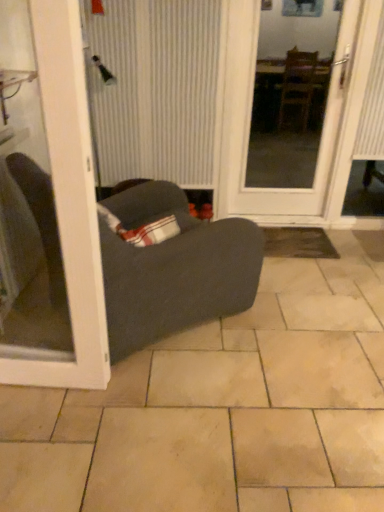
Question: Does beige ceramic tile at center have a greater height compared to white glossy door at left, arranged as the 1th door when viewed from the left?

Choices:
 (A) yes
 (B) no

Answer: (B)

Question: Does beige ceramic tile at center come behind white glossy door at left, acting as the 1th door starting from the front?

Choices:
 (A) yes
 (B) no

Answer: (A)

Question: Could you tell me if beige ceramic tile at center is facing white glossy door at left, acting as the 1th door starting from the front?

Choices:
 (A) no
 (B) yes

Answer: (A)

Question: From the image's perspective, is beige ceramic tile at center located above white glossy door at left, arranged as the 1th door when viewed from the left?

Choices:
 (A) yes
 (B) no

Answer: (B)

Question: Is beige ceramic tile at center thinner than white glossy door at left, placed as the second door when sorted from right to left?

Choices:
 (A) no
 (B) yes

Answer: (A)

Question: From the image's perspective, is white striped curtain at center located above or below beige ceramic tile at center?

Choices:
 (A) below
 (B) above

Answer: (B)

Question: In the image, is white striped curtain at center on the left side or the right side of beige ceramic tile at center?

Choices:
 (A) left
 (B) right

Answer: (A)

Question: In terms of width, does white striped curtain at center look wider or thinner when compared to beige ceramic tile at center?

Choices:
 (A) wide
 (B) thin

Answer: (B)

Question: Is point (112, 12) positioned closer to the camera than point (241, 441)?

Choices:
 (A) closer
 (B) farther

Answer: (B)

Question: From a real-world perspective, is white striped curtain at center positioned above or below white glossy door at left, placed as the second door when sorted from right to left?

Choices:
 (A) below
 (B) above

Answer: (B)

Question: Is white striped curtain at center situated inside white glossy door at left, acting as the 1th door starting from the front, or outside?

Choices:
 (A) inside
 (B) outside

Answer: (B)

Question: Is point (102, 51) positioned closer to the camera than point (92, 345)?

Choices:
 (A) farther
 (B) closer

Answer: (A)

Question: Considering the positions of white striped curtain at center and white glossy door at left, placed as the second door when sorted from right to left, in the image, is white striped curtain at center wider or thinner than white glossy door at left, placed as the second door when sorted from right to left,?

Choices:
 (A) thin
 (B) wide

Answer: (A)

Question: From a real-world perspective, is white glossy door at center, which appears as the first door when viewed from the right, above or below dark gray fabric studio couch at center?

Choices:
 (A) above
 (B) below

Answer: (A)

Question: Based on their positions, is white glossy door at center, the 1th door when ordered from back to front, located to the left or right of dark gray fabric studio couch at center?

Choices:
 (A) left
 (B) right

Answer: (B)